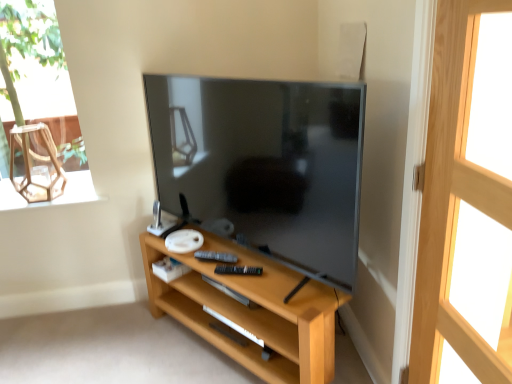
Where is `vacant region to the right of black plastic remote at center`? vacant region to the right of black plastic remote at center is located at coordinates (244, 262).